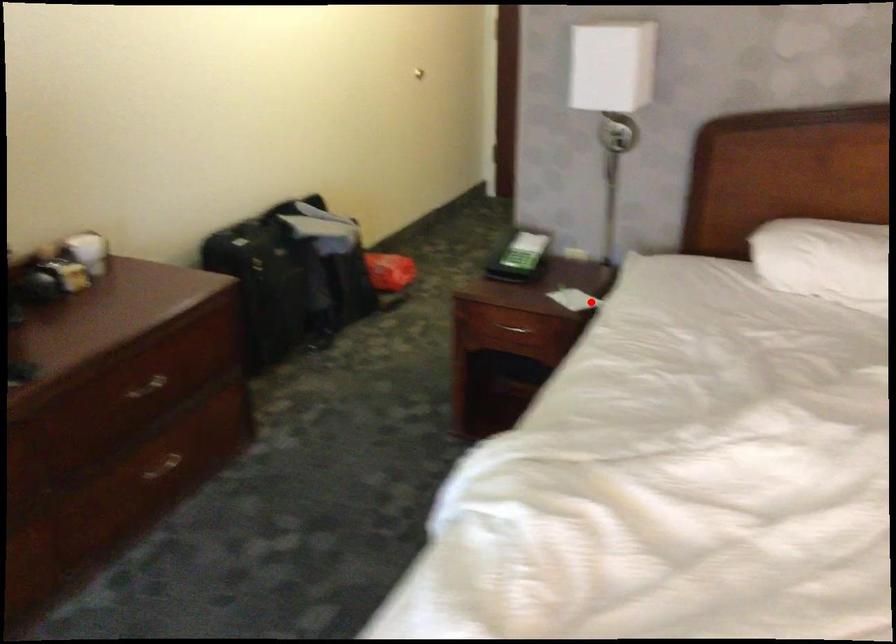
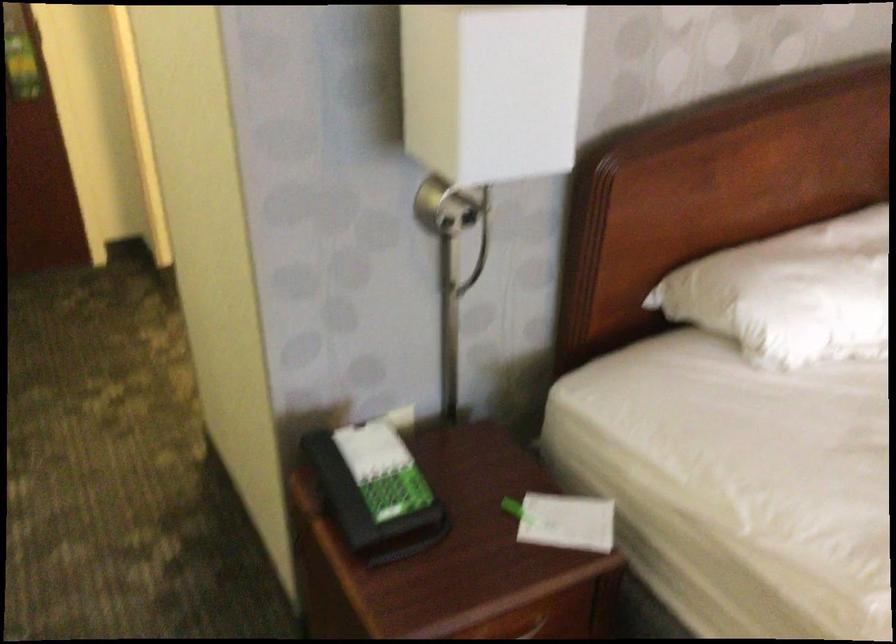
Question: I am providing you with two images of the same scene from different viewpoints. A red point is shown in image1. For the corresponding object point in image2, is it positioned nearer or farther from the camera?

Choices:
 (A) Nearer
 (B) Farther

Answer: (A)